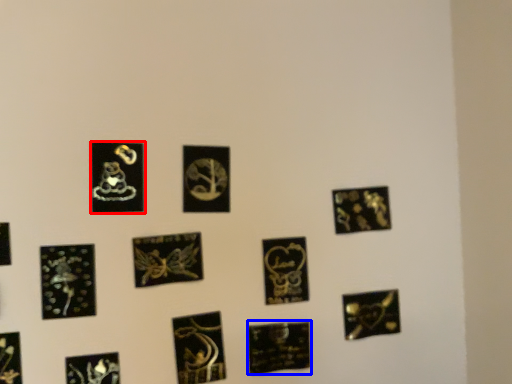
Question: Which of the following is the closest to the observer, picture frame (highlighted by a red box) or picture frame (highlighted by a blue box)?

Choices:
 (A) picture frame
 (B) picture frame

Answer: (A)